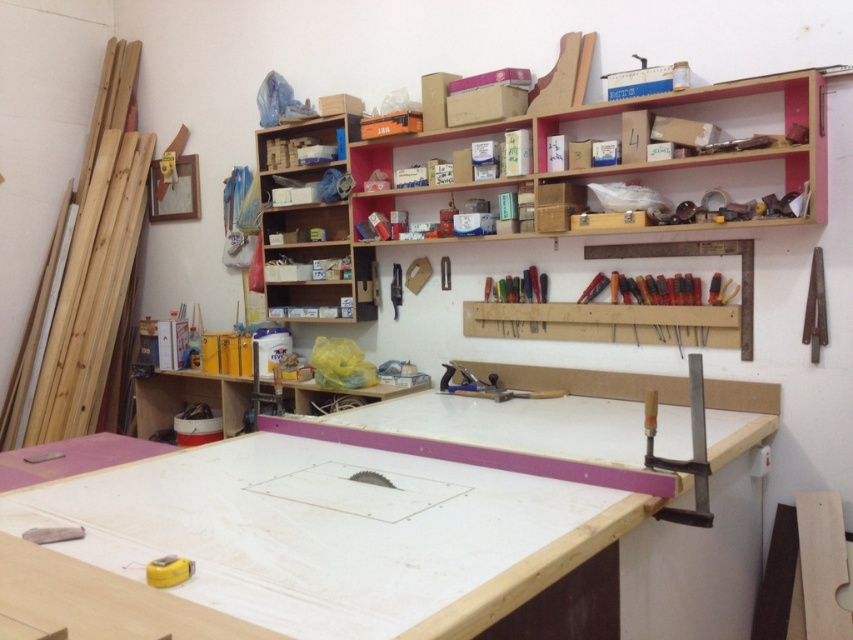
Image resolution: width=853 pixels, height=640 pixels. I want to click on wooden shelves at upper center, so click(x=303, y=212).

Is wooden shelves at upper center in front of metallic silver clamp at center?

Yes, wooden shelves at upper center is in front of metallic silver clamp at center.

Is point (306, 260) positioned before point (401, 284)?

No.

Locate an element on the screen. This screenshot has width=853, height=640. wooden shelves at upper center is located at coordinates (303, 212).

Which is behind, point (561, 390) or point (442, 268)?

Positioned behind is point (442, 268).

From the picture: Between metallic blue plane at center and metallic silver ruler at upper center, which one appears on the right side from the viewer's perspective?

Positioned to the right is metallic blue plane at center.

Describe the element at coordinates (486, 385) in the screenshot. Image resolution: width=853 pixels, height=640 pixels. I see `metallic blue plane at center` at that location.

This screenshot has width=853, height=640. In order to click on metallic blue plane at center in this screenshot , I will do `click(486, 385)`.

Find the location of a particular element. multicolored plastic screwdriver set at center is located at coordinates (518, 288).

In the scene shown: Who is more forward, [509,278] or [397,305]?

Point [509,278] is more forward.

This screenshot has height=640, width=853. In order to click on multicolored plastic screwdriver set at center in this screenshot , I will do `click(518, 288)`.